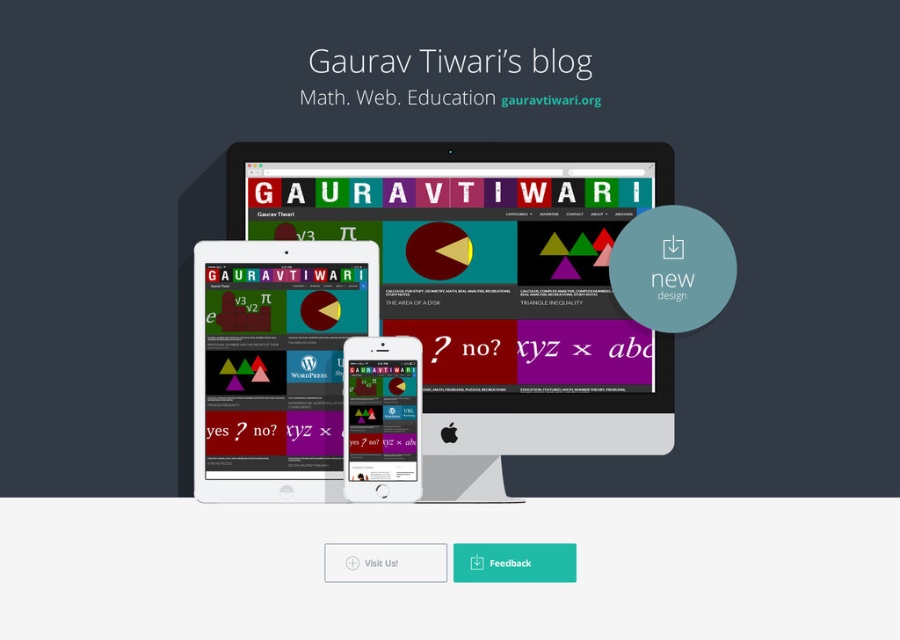
Question: Does satin silver monitor at center have a smaller size compared to white glossy tablet at center?

Choices:
 (A) no
 (B) yes

Answer: (A)

Question: Estimate the real-world distances between objects in this image. Which object is farther from the white glossy tablet at center?

Choices:
 (A) satin silver monitor at center
 (B) white glossy text at center

Answer: (B)

Question: Does satin silver monitor at center appear under white glossy tablet at center?

Choices:
 (A) yes
 (B) no

Answer: (B)

Question: Which point appears closest to the camera in this image?

Choices:
 (A) (304, 292)
 (B) (367, 353)
 (C) (333, 326)

Answer: (B)

Question: Among these objects, which one is farthest from the camera?

Choices:
 (A) matte white tablet at center
 (B) satin silver monitor at center
 (C) white glossy text at center
 (D) white glossy tablet at center

Answer: (C)

Question: Can you confirm if satin silver monitor at center is smaller than white glossy text at center?

Choices:
 (A) no
 (B) yes

Answer: (A)